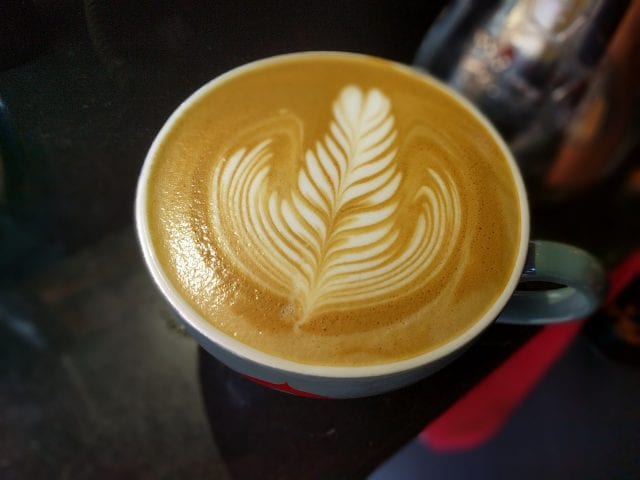
Locate an element on the screen. This screenshot has height=480, width=640. floor in distance is located at coordinates (72, 73).